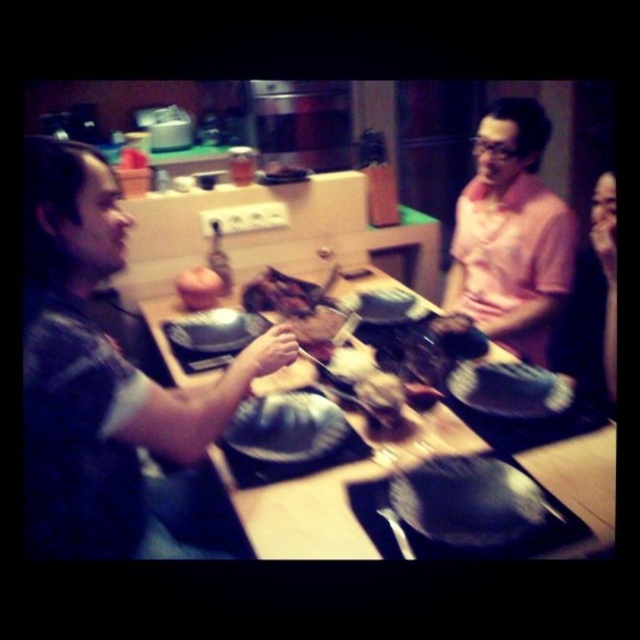
This screenshot has height=640, width=640. What do you see at coordinates (285, 428) in the screenshot?
I see `matte black platter at center` at bounding box center [285, 428].

Between point (317, 458) and point (476, 397), which one is positioned in front?

Point (317, 458) is in front.

What are the coordinates of `matte black platter at center` in the screenshot? It's located at (285, 428).

Between point (524, 380) and point (604, 269), which one is positioned behind?

Point (604, 269)

Who is positioned more to the right, spongy white bread at center or smooth skin face at upper right?

From the viewer's perspective, smooth skin face at upper right appears more on the right side.

What do you see at coordinates (515, 388) in the screenshot? The image size is (640, 640). I see `spongy white bread at center` at bounding box center [515, 388].

This screenshot has height=640, width=640. Identify the location of spongy white bread at center. (515, 388).

Which is in front, point (481, 396) or point (400, 394)?

Point (400, 394) is in front.

Does spongy white bread at center have a greater height compared to smooth brown rice at center?

Yes.

Where is `spongy white bread at center`? spongy white bread at center is located at coordinates (515, 388).